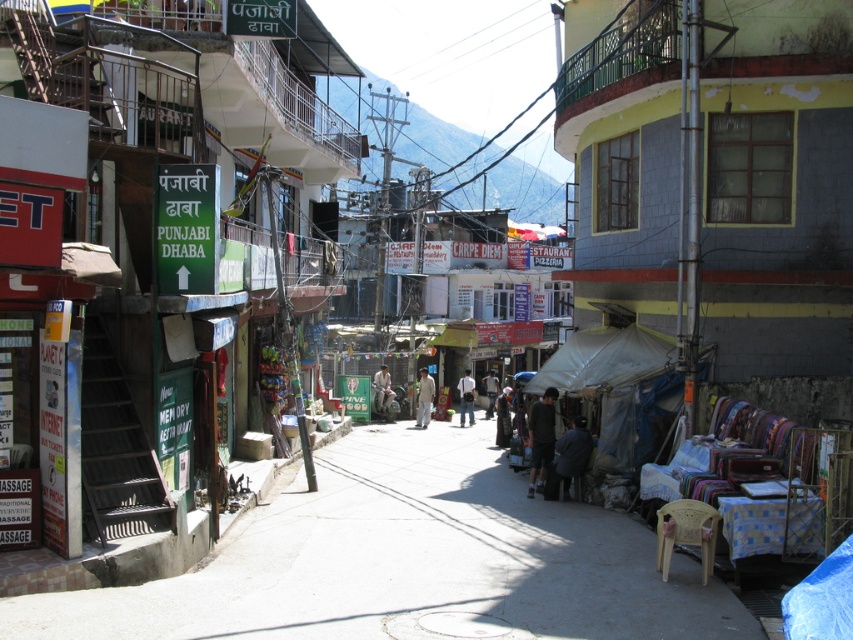
Who is more forward, (495,408) or (376,378)?

Point (376,378) is more forward.

Is dark blue fabric at center in front of light brown leather jacket at center?

Yes, it is.

Between point (498, 404) and point (376, 396), which one is positioned behind?

Positioned behind is point (376, 396).

Locate an element on the screen. The height and width of the screenshot is (640, 853). dark blue fabric at center is located at coordinates (503, 417).

Does plastic chair at center appear on the right side of light brown leather jacket at center?

Correct, you'll find plastic chair at center to the right of light brown leather jacket at center.

Does point (422, 566) come closer to viewer compared to point (383, 397)?

Yes, it is.

At what (x,y) coordinates should I click in order to perform the action: click on plastic chair at center. Please return your answer as a coordinate pair (x, y). The height and width of the screenshot is (640, 853). Looking at the image, I should click on (407, 561).

Can you confirm if dark blue fabric at center is bigger than light beige fabric jacket at center?

Yes.

How far apart are dark blue fabric at center and light beige fabric jacket at center?

dark blue fabric at center and light beige fabric jacket at center are 5.19 meters apart.

This screenshot has width=853, height=640. Find the location of `dark blue fabric at center`. dark blue fabric at center is located at coordinates (503, 417).